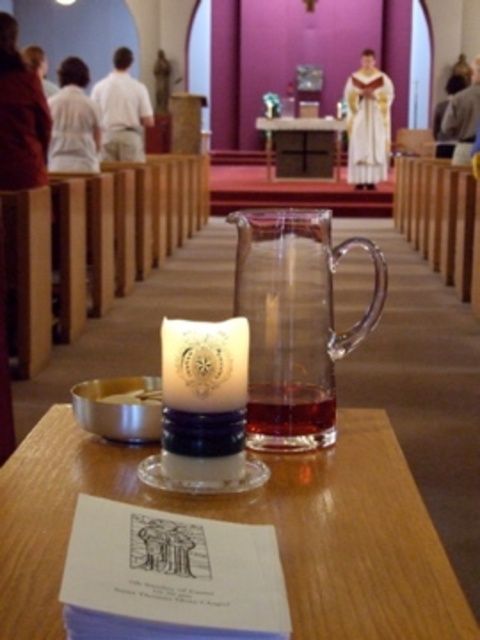
Question: Can you confirm if transparent glass jug at center is smaller than white wax candle at center?

Choices:
 (A) yes
 (B) no

Answer: (B)

Question: Observing the image, what is the correct spatial positioning of white wax candle at center in reference to transparent glass table at center?

Choices:
 (A) below
 (B) above

Answer: (A)

Question: Which point is farther to the camera?

Choices:
 (A) transparent glass table at center
 (B) translucent glass table at center
 (C) white wax candle at center

Answer: (A)

Question: Considering the real-world distances, which object is closest to the white wax candle at center?

Choices:
 (A) translucent glass table at center
 (B) transparent glass jug at center

Answer: (B)

Question: Is white wax candle at center to the right of transparent glass table at center from the viewer's perspective?

Choices:
 (A) no
 (B) yes

Answer: (A)

Question: Considering the real-world distances, which object is farthest from the transparent glass table at center?

Choices:
 (A) transparent glass jug at center
 (B) translucent glass table at center

Answer: (B)